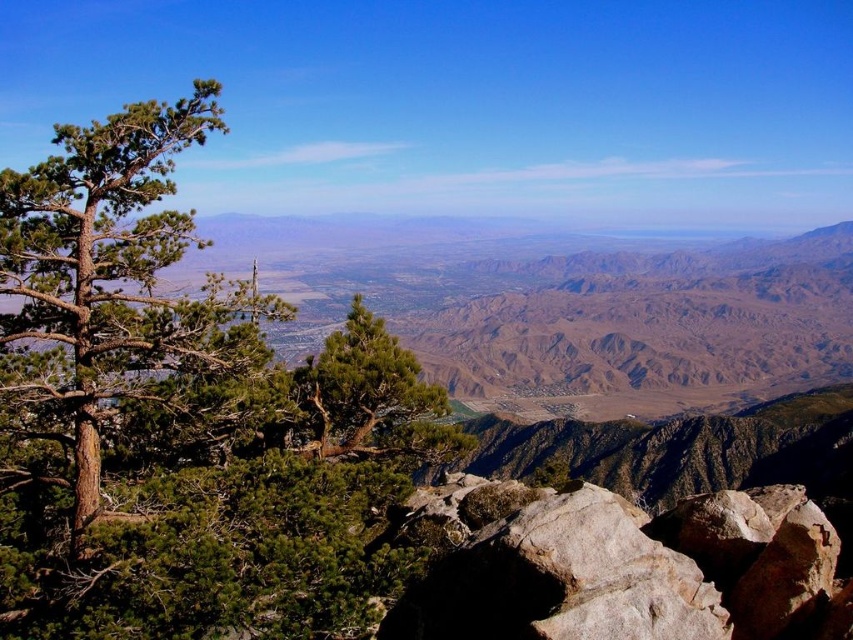
Who is positioned more to the left, green rough bark tree at left or gray rough rock at lower right?

Positioned to the left is green rough bark tree at left.

In the scene shown: Can you confirm if green rough bark tree at left is wider than gray rough rock at lower right?

No, green rough bark tree at left is not wider than gray rough rock at lower right.

Does point (68, 372) come farther from viewer compared to point (556, 531)?

No, it is not.

The image size is (853, 640). I want to click on green rough bark tree at left, so click(x=108, y=284).